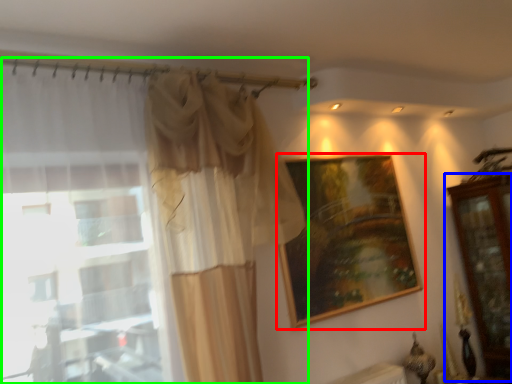
Question: Considering the real-world distances, which object is farthest from picture frame (highlighted by a red box)? dresser (highlighted by a blue box) or curtain (highlighted by a green box)?

Choices:
 (A) dresser
 (B) curtain

Answer: (A)